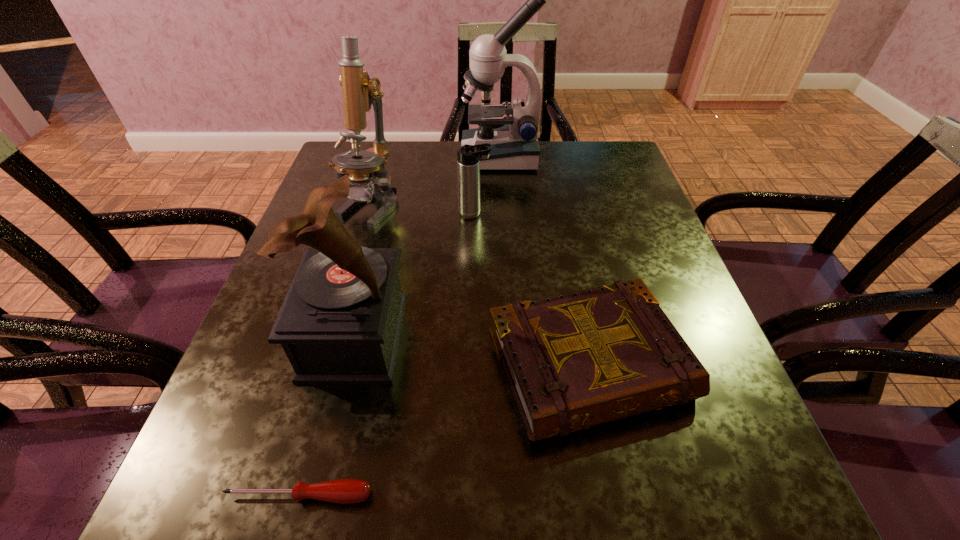
Find the location of a particular element. the right microscope is located at coordinates (513, 133).

Where is `the farthest object`? The image size is (960, 540). the farthest object is located at coordinates (513, 133).

Find the location of a particular element. the nearer microscope is located at coordinates (359, 92).

This screenshot has width=960, height=540. Find the location of `the fourth shortest object`. the fourth shortest object is located at coordinates pyautogui.click(x=340, y=323).

Where is `the third shortest object`? Image resolution: width=960 pixels, height=540 pixels. the third shortest object is located at coordinates (468, 161).

This screenshot has height=540, width=960. In order to click on the second shortest object in this screenshot , I will do `click(575, 360)`.

This screenshot has height=540, width=960. Find the location of `the nearest object`. the nearest object is located at coordinates (343, 491).

At what (x,y) coordinates should I click in order to perform the action: click on screwdriver. Please return your answer as a coordinate pair (x, y). Looking at the image, I should click on (343, 491).

Where is `free region located 0.250m at the eyepiece of the farther microscope`? The image size is (960, 540). free region located 0.250m at the eyepiece of the farther microscope is located at coordinates (372, 157).

Identify the location of blank space located at the eyepiece of the farther microscope. The height and width of the screenshot is (540, 960). (408, 157).